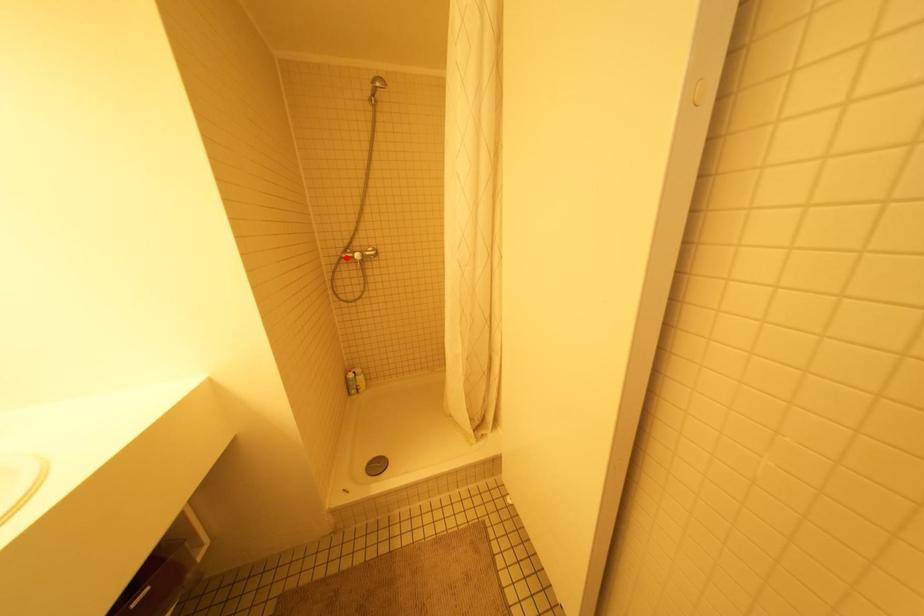
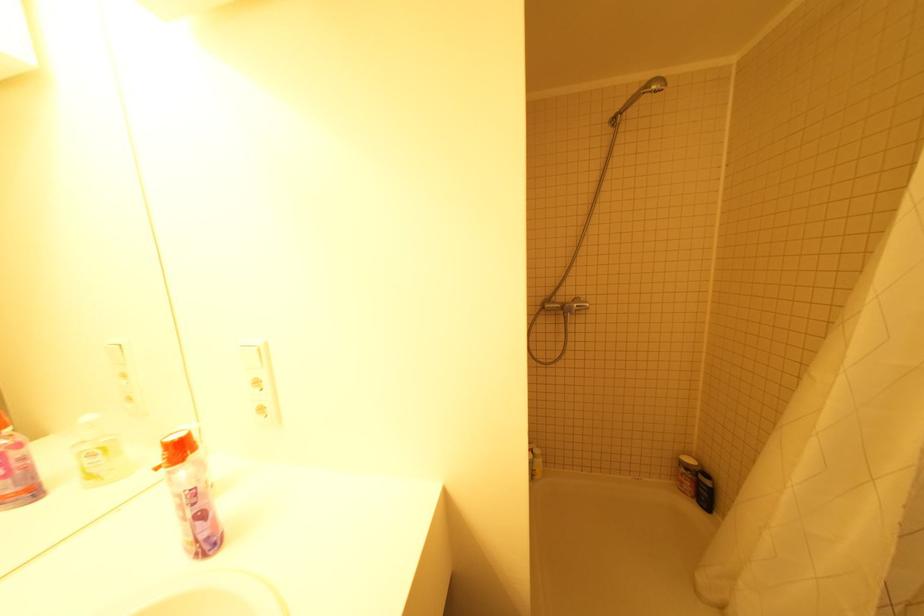
The point at the highlighted location is marked in the first image. Where is the corresponding point in the second image?

(550, 310)